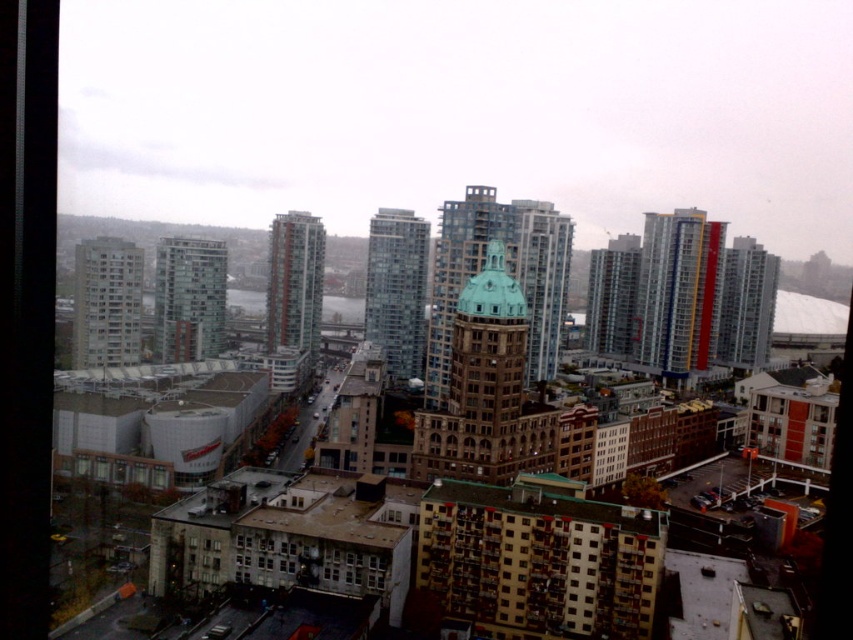
Question: Is red brick building at center to the right of matte glass building at center from the viewer's perspective?

Choices:
 (A) yes
 (B) no

Answer: (B)

Question: Among these points, which one is nearest to the camera?

Choices:
 (A) (224, 314)
 (B) (114, 301)
 (C) (440, 218)

Answer: (C)

Question: Considering the relative positions of brown textured apartment building at lower center and glassy reflective skyscraper at center in the image provided, where is brown textured apartment building at lower center located with respect to glassy reflective skyscraper at center?

Choices:
 (A) right
 (B) left

Answer: (A)

Question: Which of the following is the farthest from the observer?

Choices:
 (A) (224, 321)
 (B) (421, 365)
 (C) (279, 339)

Answer: (A)

Question: Which point appears farthest from the camera in this image?

Choices:
 (A) click(x=601, y=337)
 (B) click(x=177, y=280)
 (C) click(x=477, y=244)
 (D) click(x=265, y=285)

Answer: (D)

Question: Does matte glass building at left have a larger size compared to red brick building at center?

Choices:
 (A) yes
 (B) no

Answer: (B)